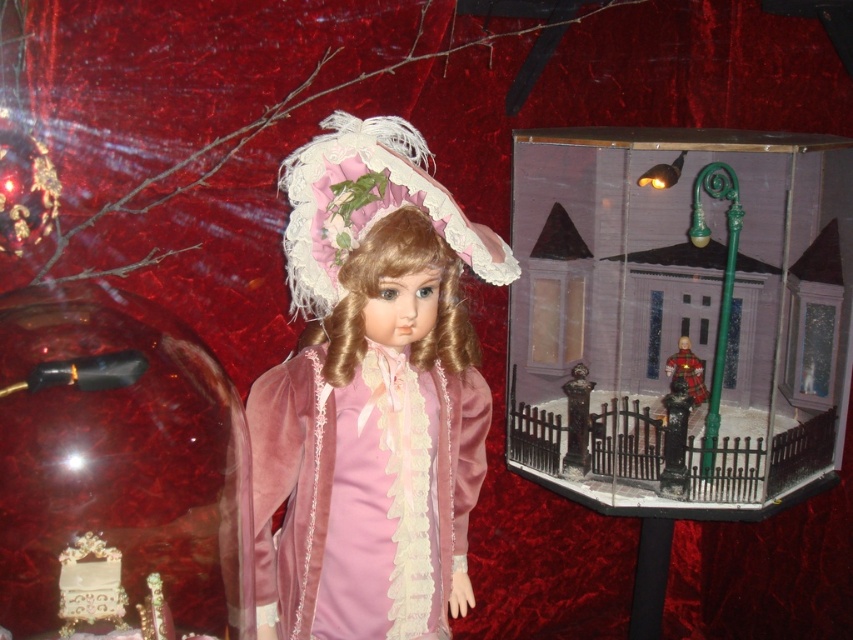
Which is more to the right, transparent plastic diorama at right or velvet pink doll at center?

transparent plastic diorama at right is more to the right.

Can you confirm if transparent plastic diorama at right is positioned to the right of velvet pink doll at center?

Indeed, transparent plastic diorama at right is positioned on the right side of velvet pink doll at center.

Find the location of a particular element. The height and width of the screenshot is (640, 853). transparent plastic diorama at right is located at coordinates (679, 314).

At what (x,y) coordinates should I click in order to perform the action: click on transparent plastic diorama at right. Please return your answer as a coordinate pair (x, y). Looking at the image, I should click on (679, 314).